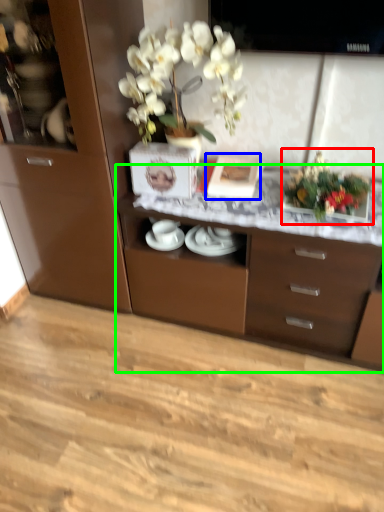
Question: Which object is the farthest from floral arrangement (highlighted by a red box)? Choose among these: picture frame (highlighted by a blue box) or desk (highlighted by a green box).

Choices:
 (A) picture frame
 (B) desk

Answer: (B)